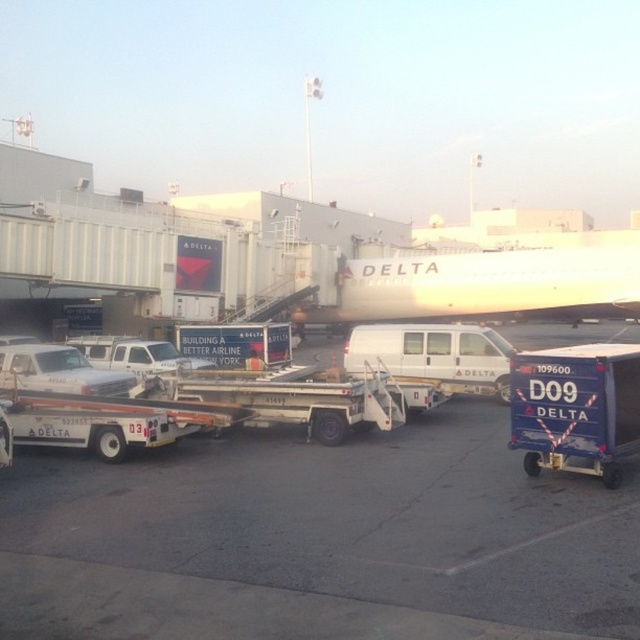
Question: Is the position of white asphalt tarmac at center more distant than that of white glossy airplane at upper center?

Choices:
 (A) no
 (B) yes

Answer: (A)

Question: Among these objects, which one is nearest to the camera?

Choices:
 (A) white asphalt tarmac at center
 (B) white glossy airplane at upper center

Answer: (A)

Question: Does white asphalt tarmac at center have a smaller size compared to white glossy airplane at upper center?

Choices:
 (A) no
 (B) yes

Answer: (B)

Question: Does white asphalt tarmac at center have a smaller size compared to white glossy airplane at upper center?

Choices:
 (A) yes
 (B) no

Answer: (A)